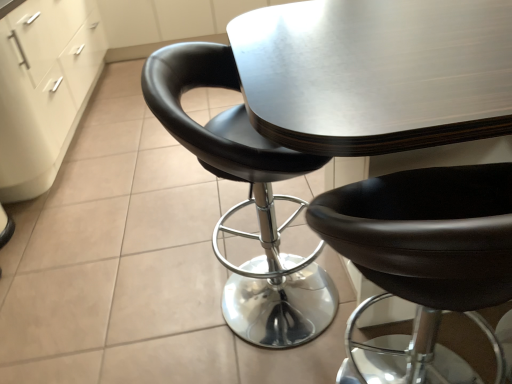
Question: Does black leather chair at center, which is the 2th chair from right to left, lie in front of white matte file cabinet at lower left?

Choices:
 (A) yes
 (B) no

Answer: (A)

Question: Is white matte file cabinet at lower left surrounded by black leather chair at center, which is the 2th chair from right to left?

Choices:
 (A) yes
 (B) no

Answer: (B)

Question: Considering the relative sizes of black leather chair at center, which is the 2th chair from right to left, and white matte file cabinet at lower left in the image provided, is black leather chair at center, which is the 2th chair from right to left, thinner than white matte file cabinet at lower left?

Choices:
 (A) yes
 (B) no

Answer: (A)

Question: Does black leather chair at center, which is the 2th chair from right to left, have a smaller size compared to white matte file cabinet at lower left?

Choices:
 (A) yes
 (B) no

Answer: (A)

Question: Does black leather chair at center, which is the 1th chair from left to right, lie behind white matte file cabinet at lower left?

Choices:
 (A) yes
 (B) no

Answer: (B)

Question: From the image's perspective, is black leather chair at center, the second chair viewed from the left, positioned above or below white matte file cabinet at lower left?

Choices:
 (A) above
 (B) below

Answer: (B)

Question: Is black leather chair at center, the second chair viewed from the left, taller or shorter than white matte file cabinet at lower left?

Choices:
 (A) tall
 (B) short

Answer: (B)

Question: Considering the relative positions of black leather chair at center, the first chair in the right-to-left sequence, and white matte file cabinet at lower left in the image provided, is black leather chair at center, the first chair in the right-to-left sequence, to the left or to the right of white matte file cabinet at lower left?

Choices:
 (A) left
 (B) right

Answer: (B)

Question: Which is correct: black leather chair at center, the second chair viewed from the left, is inside white matte file cabinet at lower left, or outside of it?

Choices:
 (A) outside
 (B) inside

Answer: (A)

Question: From a real-world perspective, is black leather chair at center, which is the 1th chair from left to right, positioned above or below white matte file cabinet at lower left?

Choices:
 (A) above
 (B) below

Answer: (B)

Question: Is point (321, 248) positioned closer to the camera than point (91, 51)?

Choices:
 (A) farther
 (B) closer

Answer: (B)

Question: Relative to white matte file cabinet at lower left, is black leather chair at center, which is the 1th chair from left to right, in front or behind?

Choices:
 (A) behind
 (B) front

Answer: (B)

Question: From their relative heights in the image, would you say black leather chair at center, which is the 1th chair from left to right, is taller or shorter than white matte file cabinet at lower left?

Choices:
 (A) tall
 (B) short

Answer: (B)

Question: Is white matte file cabinet at lower left inside or outside of black leather chair at center, which is the 2th chair from right to left?

Choices:
 (A) outside
 (B) inside

Answer: (A)

Question: Is white matte file cabinet at lower left wider or thinner than black leather chair at center, which is the 1th chair from left to right?

Choices:
 (A) wide
 (B) thin

Answer: (A)